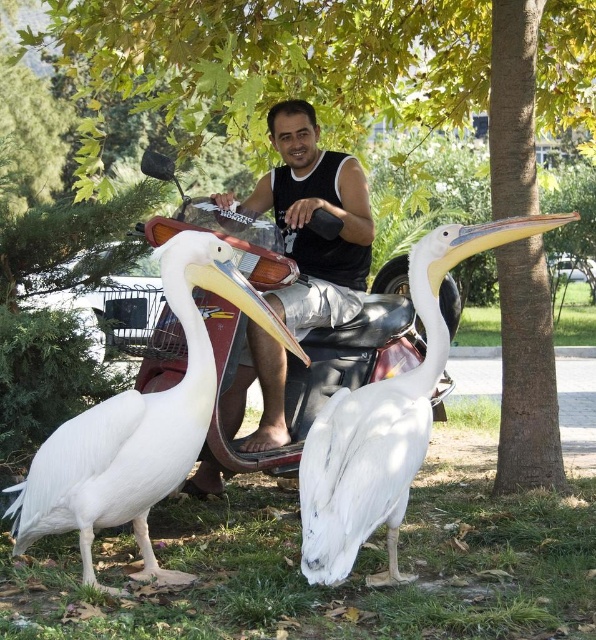
You are a photographer trying to capture the white matte pelican at center in your shot. The camera is positioned at point 0,0. Which direction should you move the camera to get the pelican into the frame?

The white matte pelican at center is located at point (139, 426). Since the camera is at (0, 0), you should move the camera upward and to the right to center the pelican in the frame.

You are standing in the scene and want to take a photo of the white feathered pelican at center without getting too close. If you can take a clear photo from 10 feet away, will you be able to do so?

The white feathered pelican at center and viewer are 8.12 feet apart, so yes, you can take a clear photo from 10 feet away since you are already within the required distance.